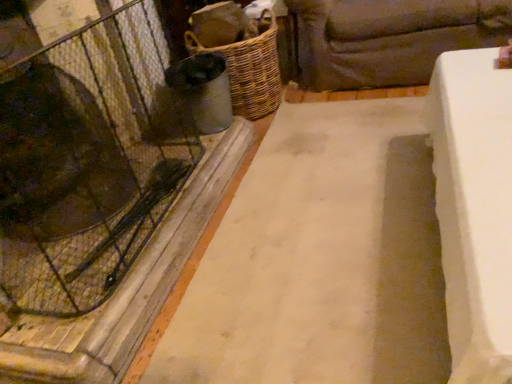
Image resolution: width=512 pixels, height=384 pixels. In order to click on empty space that is to the right of woven brown basket at center-left in this screenshot , I will do `click(320, 104)`.